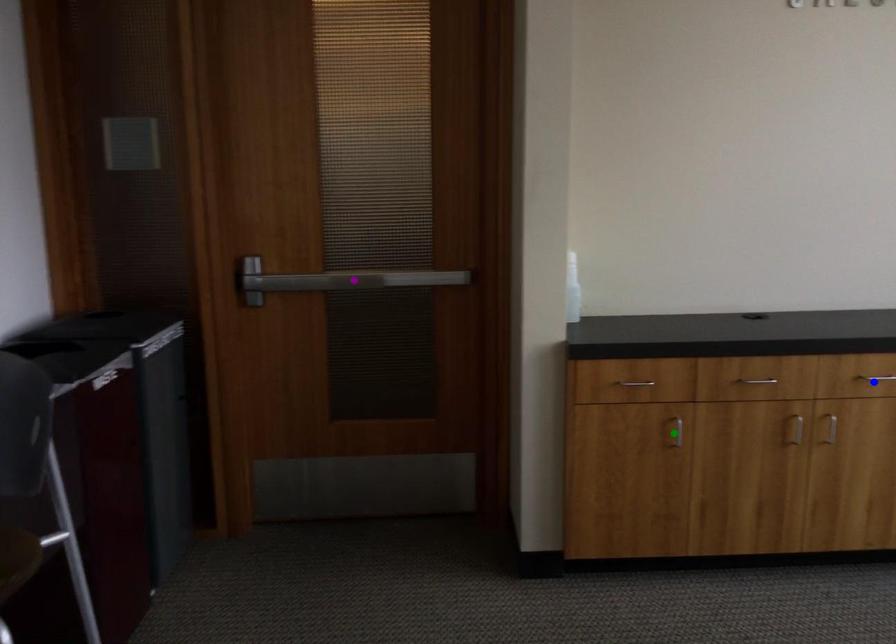
Order these from nearest to farthest:
- purple point
- green point
- blue point

1. blue point
2. green point
3. purple point